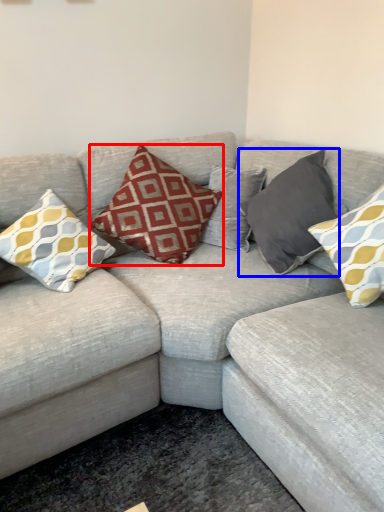
Question: Which of the following is the closest to the observer, pillow (highlighted by a red box) or pillow (highlighted by a blue box)?

Choices:
 (A) pillow
 (B) pillow

Answer: (B)